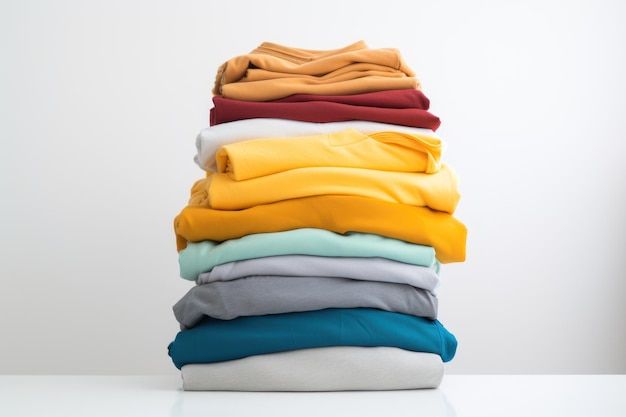
Locate an element on the screen. laundry on counter is located at coordinates (303, 368), (298, 321), (295, 302), (321, 266), (312, 206), (320, 172), (308, 144), (249, 124), (321, 107), (350, 85).